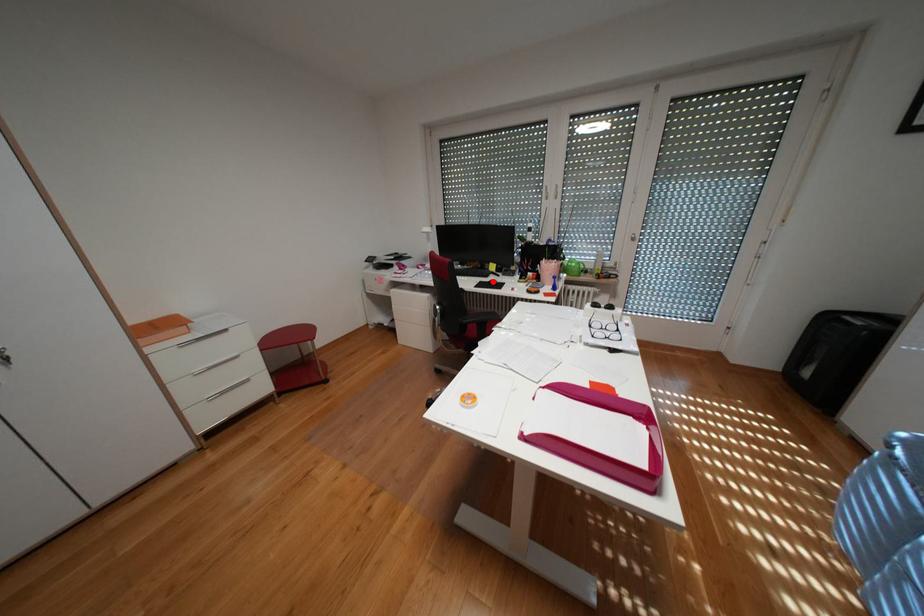
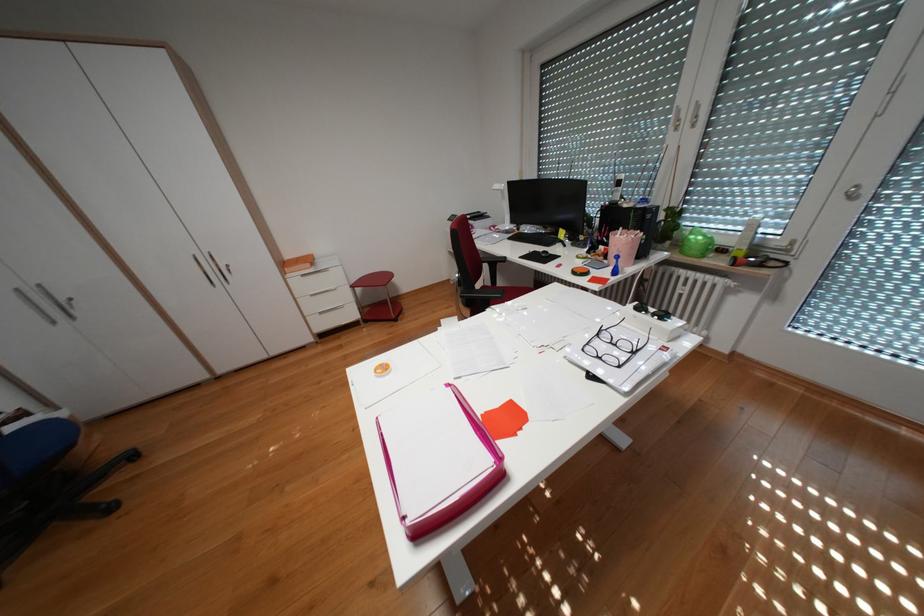
In the second image, find the point that corresponds to the highlighted location in the first image.

(546, 252)